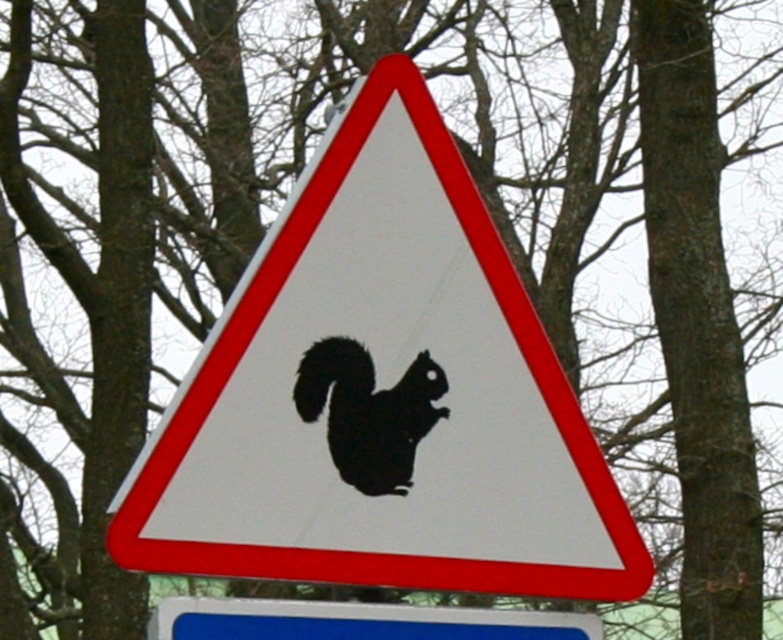
You are standing in front of the triangular road sign with a red border and a white background. You notice two points marked on the sign at coordinates point (558, 618) and point (352, 417). Which point is closer to you?

Point (352, 417) is closer to you because it is less further to the camera than point (558, 618).